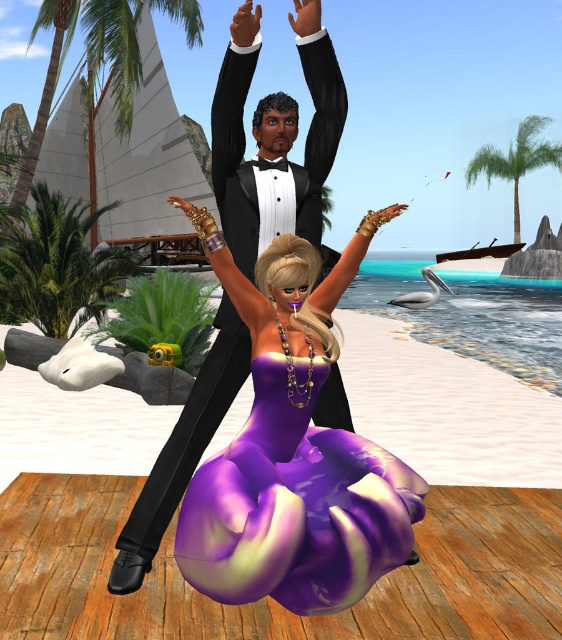
Question: Considering the relative positions of green leafy palm tree at left and green leafy palm tree at upper right in the image provided, where is green leafy palm tree at left located with respect to green leafy palm tree at upper right?

Choices:
 (A) right
 (B) left

Answer: (B)

Question: Is black satin tuxedo at center to the right of green leafy palm tree at upper right from the viewer's perspective?

Choices:
 (A) yes
 (B) no

Answer: (B)

Question: Which of the following is the closest to the observer?

Choices:
 (A) (43, 259)
 (B) (196, 28)
 (C) (238, 324)
 (D) (312, 522)

Answer: (D)

Question: Which point is closer to the camera?

Choices:
 (A) (301, 426)
 (B) (88, 13)
 (C) (1, 289)
 (D) (533, 145)

Answer: (A)

Question: Estimate the real-world distances between objects in this image. Which object is farther from the green leafy palm tree at left?

Choices:
 (A) green leafy palm tree at upper right
 (B) green leafy palm tree at upper left

Answer: (A)

Question: Is shiny purple dress at center thinner than green leafy palm tree at left?

Choices:
 (A) yes
 (B) no

Answer: (B)